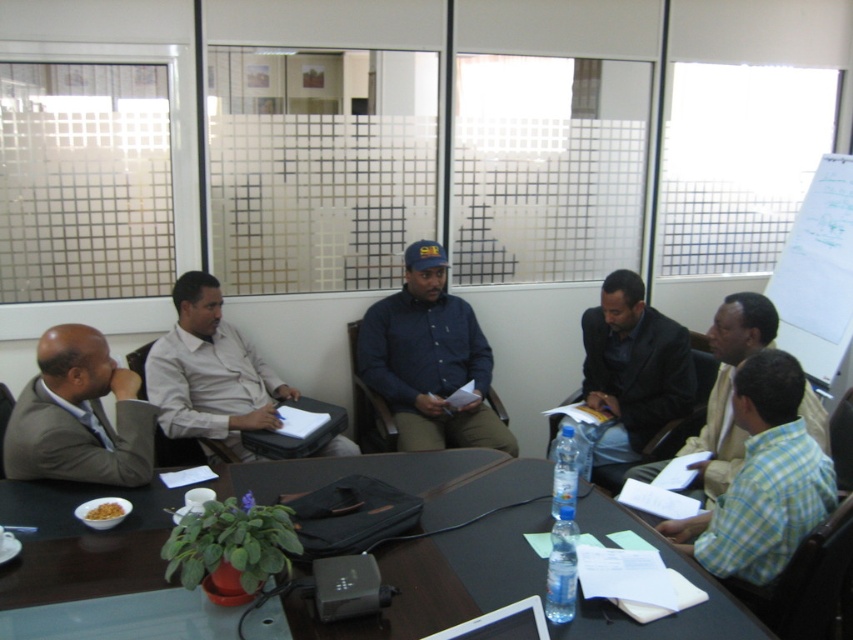
You are standing at the entrance of the meeting room. Where is the brown wooden table at center located in relation to your position?

The brown wooden table at center is located at point 0.905 on the x axis and 0.523 on the y axis relative to your position at the entrance.

You are standing at the point labeled point (332, 442) and want to walk to the door located at the back of the room. There is an obstacle at point labeled point (358, 349). Will you have to go around the obstacle to reach the door?

Since point (358, 349) is behind point (332, 442), the obstacle is already behind you, so you won t need to go around it to reach the door at the back of the room.

From the picture: You are sitting at the conference table and need to pass a document to someone across from you. There are two points marked on the table at coordinates point (x=392, y=582) and point (x=393, y=412). Which point is closer to you if you are facing the front of the room?

Point (x=392, y=582) is in front of point (x=393, y=412), so if you are facing the front of the room, the point closer to you would be point (x=392, y=582).